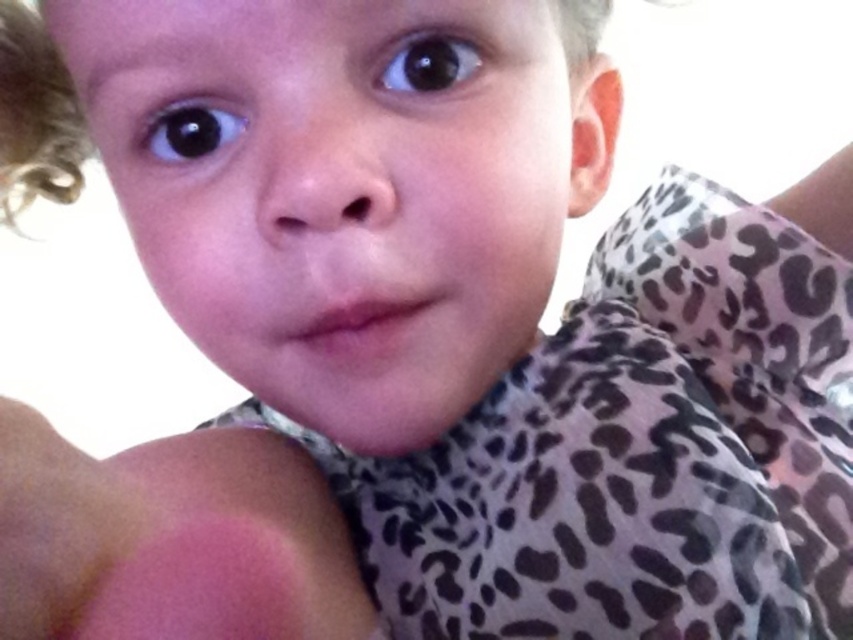
Question: Among these points, which one is farthest from the camera?

Choices:
 (A) (78, 189)
 (B) (408, 49)
 (C) (206, 141)
 (D) (39, 484)

Answer: (A)

Question: Does pink matte blush at lower left have a lesser width compared to black glossy eye at upper left?

Choices:
 (A) yes
 (B) no

Answer: (B)

Question: Is pink matte blush at lower left above black glossy eye at upper center?

Choices:
 (A) yes
 (B) no

Answer: (B)

Question: Which point appears farthest from the camera in this image?

Choices:
 (A) (326, 488)
 (B) (595, 42)

Answer: (A)

Question: Is pink matte blush at lower left positioned behind black glossy eye at upper center?

Choices:
 (A) yes
 (B) no

Answer: (B)

Question: Considering the real-world distances, which object is closest to the black glossy eye at upper left?

Choices:
 (A) pink matte blush at lower left
 (B) black glossy eye at upper center
 (C) blonde curly hair at upper left

Answer: (B)